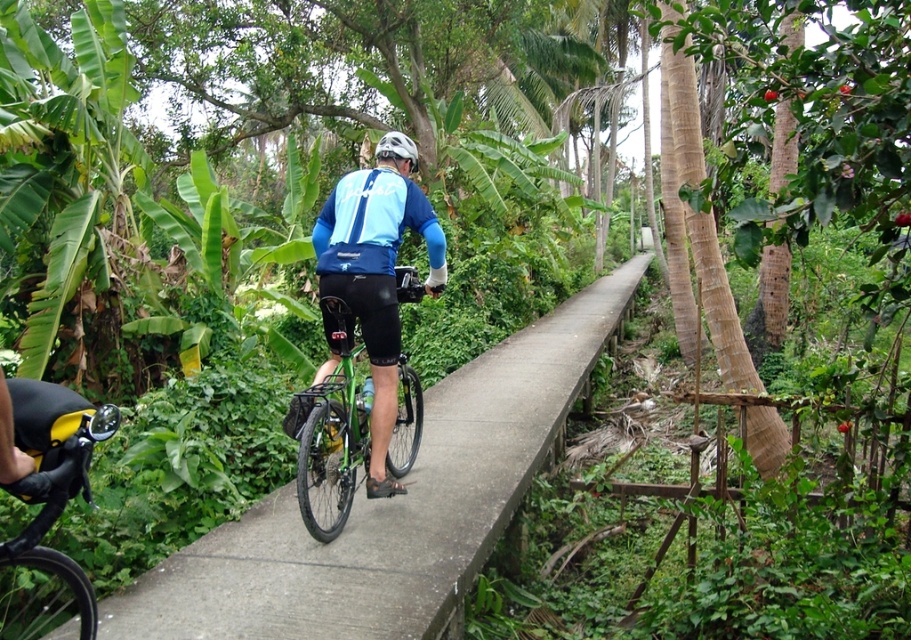
Is yellow matte bicycle handlebar at lower left in front of green matte bicycle at center?

That is True.

Is point (85, 632) in front of point (355, 451)?

Yes, it is.

The height and width of the screenshot is (640, 911). In order to click on yellow matte bicycle handlebar at lower left in this screenshot , I will do `click(49, 509)`.

Which is in front, point (331, 444) or point (393, 138)?

Point (331, 444)

Can you confirm if green matte bicycle at center is positioned above white matte bicycle helmet at center?

No.

Image resolution: width=911 pixels, height=640 pixels. Identify the location of green matte bicycle at center. (333, 433).

Is concrete at center above yellow matte bicycle handlebar at lower left?

Correct, concrete at center is located above yellow matte bicycle handlebar at lower left.

Is point (244, 564) closer to camera compared to point (26, 598)?

No, it is not.

Find the location of a particular element. The height and width of the screenshot is (640, 911). concrete at center is located at coordinates (391, 508).